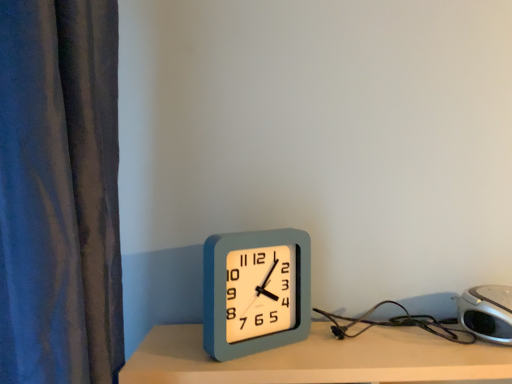
Question: From the image's perspective, would you say silver metallic alarm clock at lower right, arranged as the first alarm clock when viewed from the right, is shown under light blue plastic clock at center, positioned as the second alarm clock in right-to-left order?

Choices:
 (A) no
 (B) yes

Answer: (B)

Question: Is silver metallic alarm clock at lower right, which is the second alarm clock in left-to-right order, positioned with its back to light blue plastic clock at center, which ranks as the 1th alarm clock in left-to-right order?

Choices:
 (A) no
 (B) yes

Answer: (A)

Question: Does silver metallic alarm clock at lower right, which is the second alarm clock in left-to-right order, have a larger size compared to light blue plastic clock at center, which ranks as the 1th alarm clock in left-to-right order?

Choices:
 (A) no
 (B) yes

Answer: (B)

Question: Is light blue plastic clock at center, positioned as the second alarm clock in right-to-left order, a part of silver metallic alarm clock at lower right, arranged as the first alarm clock when viewed from the right?

Choices:
 (A) no
 (B) yes

Answer: (A)

Question: Can you confirm if silver metallic alarm clock at lower right, arranged as the first alarm clock when viewed from the right, is positioned to the right of light blue plastic clock at center, which ranks as the 1th alarm clock in left-to-right order?

Choices:
 (A) no
 (B) yes

Answer: (B)

Question: Can you confirm if silver metallic alarm clock at lower right, which is the second alarm clock in left-to-right order, is wider than light blue plastic clock at center, which ranks as the 1th alarm clock in left-to-right order?

Choices:
 (A) yes
 (B) no

Answer: (A)

Question: Can you confirm if light blue plastic clock at center, positioned as the second alarm clock in right-to-left order, is bigger than silver metallic alarm clock at lower right, which is the second alarm clock in left-to-right order?

Choices:
 (A) no
 (B) yes

Answer: (A)

Question: Is light blue plastic clock at center, positioned as the second alarm clock in right-to-left order, outside of silver metallic alarm clock at lower right, arranged as the first alarm clock when viewed from the right?

Choices:
 (A) yes
 (B) no

Answer: (A)

Question: Does light blue plastic clock at center, which ranks as the 1th alarm clock in left-to-right order, appear on the left side of silver metallic alarm clock at lower right, which is the second alarm clock in left-to-right order?

Choices:
 (A) no
 (B) yes

Answer: (B)

Question: Does light blue plastic clock at center, which ranks as the 1th alarm clock in left-to-right order, have a smaller size compared to silver metallic alarm clock at lower right, which is the second alarm clock in left-to-right order?

Choices:
 (A) yes
 (B) no

Answer: (A)

Question: Can you confirm if light blue plastic clock at center, positioned as the second alarm clock in right-to-left order, is thinner than silver metallic alarm clock at lower right, which is the second alarm clock in left-to-right order?

Choices:
 (A) yes
 (B) no

Answer: (A)

Question: From the image's perspective, is light blue plastic clock at center, which ranks as the 1th alarm clock in left-to-right order, beneath silver metallic alarm clock at lower right, which is the second alarm clock in left-to-right order?

Choices:
 (A) yes
 (B) no

Answer: (B)

Question: Looking at the image, does light blue plastic clock at center, which ranks as the 1th alarm clock in left-to-right order, seem bigger or smaller compared to silver metallic alarm clock at lower right, which is the second alarm clock in left-to-right order?

Choices:
 (A) small
 (B) big

Answer: (A)